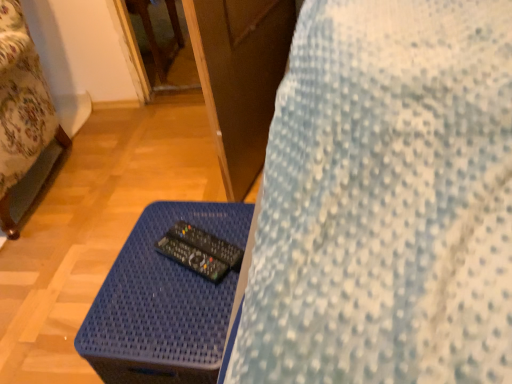
Question: From a real-world perspective, is wooden bed frame at left physically below black plastic remote at center, arranged as the second control when viewed from the top?

Choices:
 (A) no
 (B) yes

Answer: (A)

Question: Can you confirm if wooden bed frame at left is smaller than black plastic remote at center, placed as the 1th control when sorted from bottom to top?

Choices:
 (A) no
 (B) yes

Answer: (A)

Question: Is wooden bed frame at left facing away from black plastic remote at center, placed as the 1th control when sorted from bottom to top?

Choices:
 (A) no
 (B) yes

Answer: (A)

Question: Considering the relative sizes of wooden bed frame at left and black plastic remote at center, arranged as the second control when viewed from the top, in the image provided, is wooden bed frame at left taller than black plastic remote at center, arranged as the second control when viewed from the top,?

Choices:
 (A) no
 (B) yes

Answer: (B)

Question: Considering the relative sizes of wooden bed frame at left and black plastic remote at center, arranged as the second control when viewed from the top, in the image provided, is wooden bed frame at left shorter than black plastic remote at center, arranged as the second control when viewed from the top,?

Choices:
 (A) no
 (B) yes

Answer: (A)

Question: Would you consider wooden bed frame at left to be distant from black plastic remote at center, placed as the 1th control when sorted from bottom to top?

Choices:
 (A) yes
 (B) no

Answer: (B)

Question: Is black plastic remote at center, which is the 1th control in top-to-bottom order, positioned with its back to blue woven table at lower center?

Choices:
 (A) no
 (B) yes

Answer: (A)

Question: Considering the relative sizes of black plastic remote at center, which is the 1th control in top-to-bottom order, and blue woven table at lower center in the image provided, is black plastic remote at center, which is the 1th control in top-to-bottom order, shorter than blue woven table at lower center?

Choices:
 (A) yes
 (B) no

Answer: (A)

Question: Can you see black plastic remote at center, acting as the 2th control starting from the bottom, touching blue woven table at lower center?

Choices:
 (A) yes
 (B) no

Answer: (B)

Question: Is black plastic remote at center, acting as the 2th control starting from the bottom, to the left of blue woven table at lower center from the viewer's perspective?

Choices:
 (A) yes
 (B) no

Answer: (B)

Question: Is black plastic remote at center, which is the 1th control in top-to-bottom order, to the right of blue woven table at lower center from the viewer's perspective?

Choices:
 (A) yes
 (B) no

Answer: (A)

Question: Is there a large distance between black plastic remote at center, which is the 1th control in top-to-bottom order, and blue woven table at lower center?

Choices:
 (A) yes
 (B) no

Answer: (B)

Question: Can we say black plastic remote at center, placed as the 1th control when sorted from bottom to top, lies outside blue woven table at lower center?

Choices:
 (A) no
 (B) yes

Answer: (B)